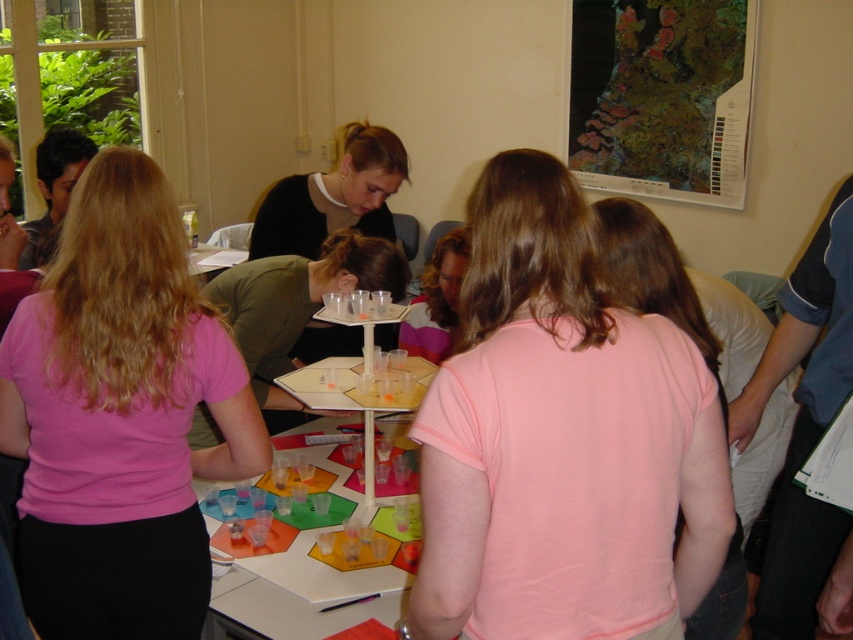
You are organizing a group activity and need to ensure everyone has enough space. The pink matte shirt at center and the matte black shirt at center are both at the table. Which participant should you ask to move to make more space?

The pink matte shirt at center should be asked to move because it is larger in size than the matte black shirt at center, taking up more space.

You are standing in the room and want to hand a document to the person wearing the pink matte shirt at center. If your arm can reach 1.5 meters, can you reach them without moving closer?

The distance between you and the pink matte shirt at center is 1.47 meters, which is within your arm reach of 1.5 meters. Yes, you can reach them without moving closer.

You are a photographer trying to capture a group photo of the participants. Since you want to ensure everyone is visible, which participant should you position closer to the camera between the pink matte shirt at center and the matte pink shirt at center?

The pink matte shirt at center should be positioned closer to the camera because it is taller than the matte pink shirt at center, ensuring they are both visible in the photo.